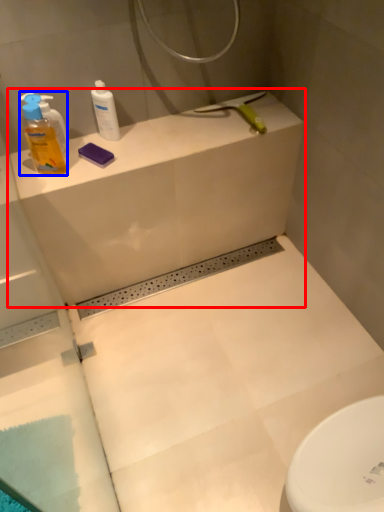
Question: Which object is further to the camera taking this photo, counter top (highlighted by a red box) or cleaning product (highlighted by a blue box)?

Choices:
 (A) counter top
 (B) cleaning product

Answer: (A)